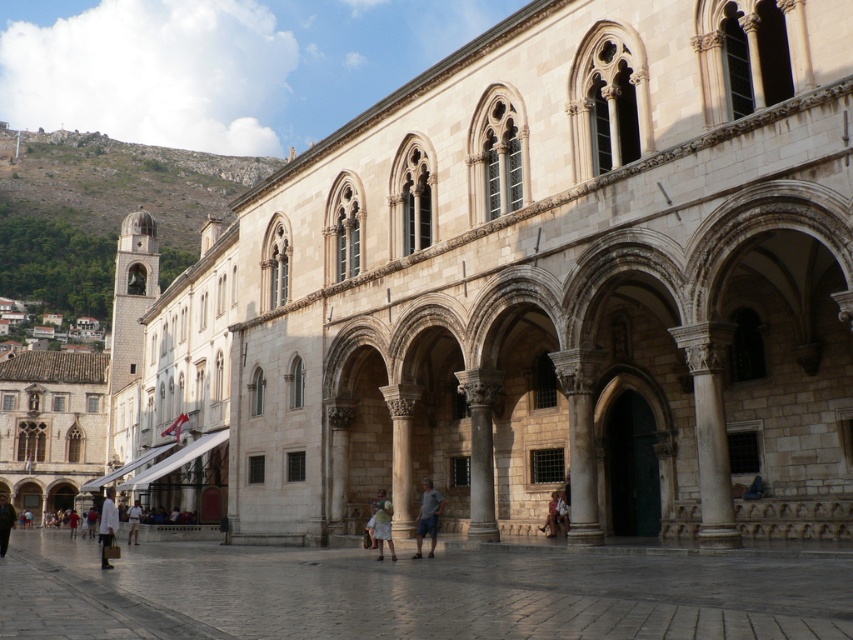
You are standing at the entrance of the historic building and want to reach the smooth stone courtyard at center. Which direction should you walk to get there?

The smooth stone courtyard at center is located at point (413, 593), so you should walk forward towards the center of the building to reach it.

You are an architect examining the historic building and notice the light beige stone column at center and the white fabric bag at lower left. Which object is smaller in size?

The light beige stone column at center is smaller than the white fabric bag at lower left.